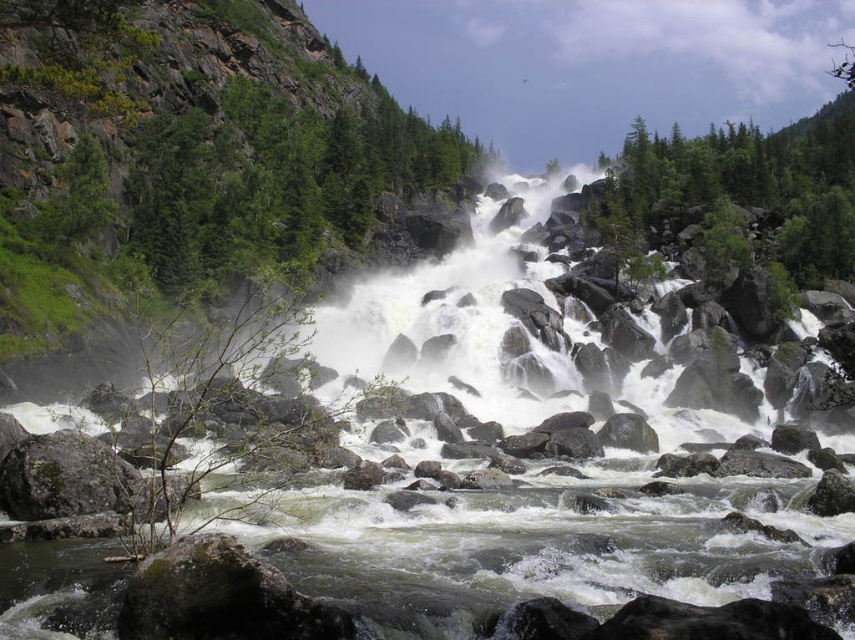
Question: Which object appears closest to the camera in this image?

Choices:
 (A) green leafy tree at left
 (B) green leafy tree at upper right

Answer: (A)

Question: Where is green leafy tree at left located in relation to green leafy tree at upper right in the image?

Choices:
 (A) above
 (B) below

Answer: (B)

Question: Which point is closer to the camera?

Choices:
 (A) (680, 225)
 (B) (246, 168)

Answer: (B)

Question: Is green leafy tree at left further to the viewer compared to green leafy tree at upper right?

Choices:
 (A) no
 (B) yes

Answer: (A)

Question: Is green leafy tree at left to the right of green leafy tree at upper right from the viewer's perspective?

Choices:
 (A) no
 (B) yes

Answer: (A)